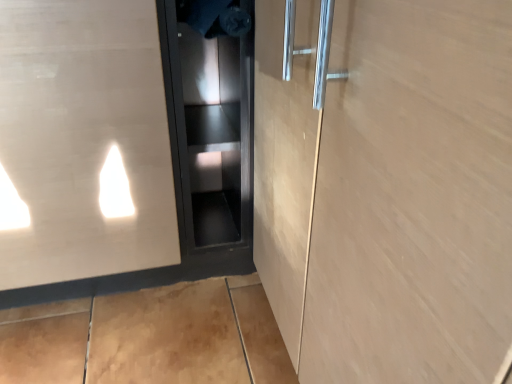
Question: Is satin silver elevator door at left, the 1th elevator door when ordered from left to right, oriented away from black matte cabinet at center, the first elevator door in the right-to-left sequence?

Choices:
 (A) no
 (B) yes

Answer: (A)

Question: From a real-world perspective, is satin silver elevator door at left, the 1th elevator door when ordered from left to right, positioned under black matte cabinet at center, placed as the 2th elevator door when sorted from left to right, based on gravity?

Choices:
 (A) yes
 (B) no

Answer: (B)

Question: From the image's perspective, would you say satin silver elevator door at left, the 1th elevator door when ordered from left to right, is shown under black matte cabinet at center, placed as the 2th elevator door when sorted from left to right?

Choices:
 (A) yes
 (B) no

Answer: (B)

Question: Does satin silver elevator door at left, the 1th elevator door when ordered from left to right, have a greater height compared to black matte cabinet at center, the first elevator door in the right-to-left sequence?

Choices:
 (A) yes
 (B) no

Answer: (A)

Question: Can you confirm if satin silver elevator door at left, the 1th elevator door when ordered from left to right, is positioned to the right of black matte cabinet at center, the first elevator door in the right-to-left sequence?

Choices:
 (A) yes
 (B) no

Answer: (B)

Question: Does satin silver elevator door at left, the second elevator door positioned from the right, have a larger size compared to black matte cabinet at center, placed as the 2th elevator door when sorted from left to right?

Choices:
 (A) no
 (B) yes

Answer: (B)

Question: Is black matte cabinet at center, placed as the 2th elevator door when sorted from left to right, thinner than satin silver elevator door at left, the 1th elevator door when ordered from left to right?

Choices:
 (A) yes
 (B) no

Answer: (A)

Question: Is black matte cabinet at center, the first elevator door in the right-to-left sequence, oriented away from satin silver elevator door at left, the second elevator door positioned from the right?

Choices:
 (A) no
 (B) yes

Answer: (A)

Question: From a real-world perspective, is black matte cabinet at center, placed as the 2th elevator door when sorted from left to right, below satin silver elevator door at left, the second elevator door positioned from the right?

Choices:
 (A) no
 (B) yes

Answer: (B)

Question: From a real-world perspective, does black matte cabinet at center, the first elevator door in the right-to-left sequence, stand above satin silver elevator door at left, the second elevator door positioned from the right?

Choices:
 (A) no
 (B) yes

Answer: (A)

Question: Can you confirm if black matte cabinet at center, the first elevator door in the right-to-left sequence, is bigger than satin silver elevator door at left, the 1th elevator door when ordered from left to right?

Choices:
 (A) yes
 (B) no

Answer: (B)

Question: From the image's perspective, would you say black matte cabinet at center, placed as the 2th elevator door when sorted from left to right, is positioned over satin silver elevator door at left, the second elevator door positioned from the right?

Choices:
 (A) no
 (B) yes

Answer: (A)

Question: From the image's perspective, relative to black matte cabinet at center, the first elevator door in the right-to-left sequence, is satin silver elevator door at left, the 1th elevator door when ordered from left to right, above or below?

Choices:
 (A) above
 (B) below

Answer: (A)